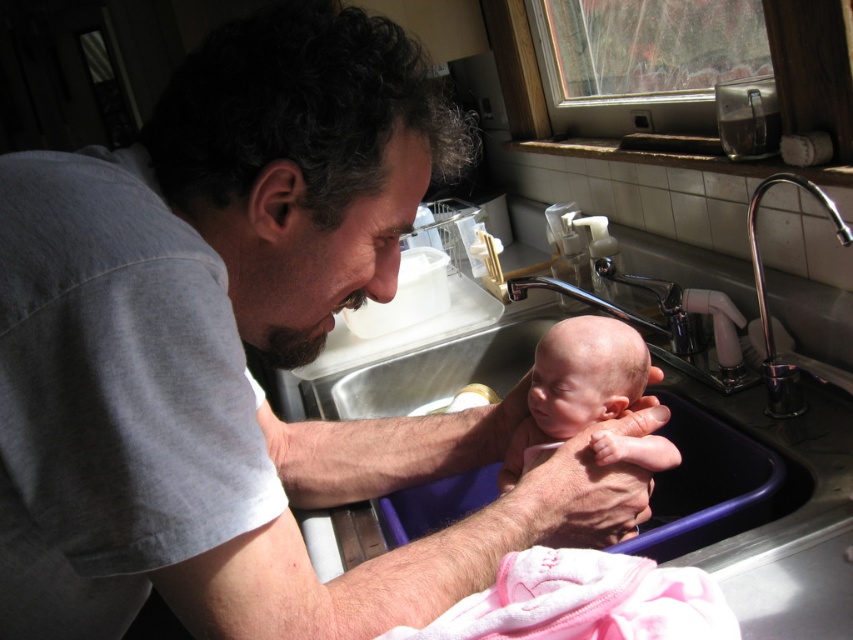
Question: Does smooth skin newborn at center come behind chrome metallic faucet at sink right?

Choices:
 (A) no
 (B) yes

Answer: (B)

Question: Does smooth skin newborn at center have a larger size compared to chrome metallic faucet at sink right?

Choices:
 (A) yes
 (B) no

Answer: (B)

Question: Which of the following is the farthest from the observer?

Choices:
 (A) (792, 355)
 (B) (595, 316)

Answer: (A)

Question: Is smooth skin newborn at center closer to the viewer compared to chrome metallic faucet at sink right?

Choices:
 (A) yes
 (B) no

Answer: (B)

Question: Which of the following is the closest to the observer?

Choices:
 (A) smooth skin newborn at center
 (B) chrome metallic faucet at sink right

Answer: (B)